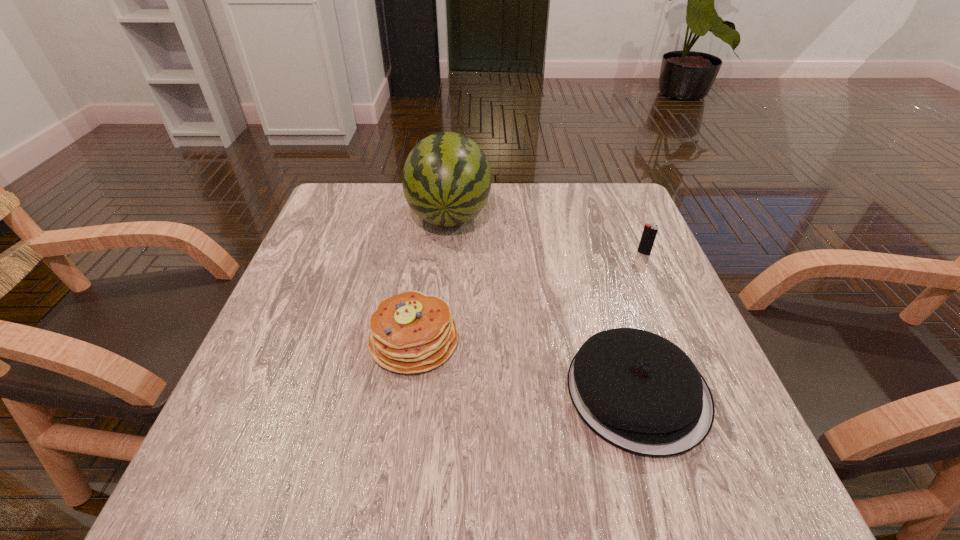
Find the location of a particular element. vacant space that's between the farthest object and the right pancake is located at coordinates (543, 303).

Where is `free space between the shorter pancake and the igniter`? free space between the shorter pancake and the igniter is located at coordinates (640, 322).

Select which object appears as the closest to the shortest object. Please provide its 2D coordinates. Your answer should be formatted as a tuple, i.e. [(x, y)], where the tuple contains the x and y coordinates of a point satisfying the conditions above.

[(410, 332)]

Select which object is the second closest to the third nearest object. Please provide its 2D coordinates. Your answer should be formatted as a tuple, i.e. [(x, y)], where the tuple contains the x and y coordinates of a point satisfying the conditions above.

[(446, 180)]

The image size is (960, 540). What are the coordinates of `free space that satisfies the following two spatial constraints: 1. at the stem end of the shorter pancake; 2. on the right side of the watermelon` in the screenshot? It's located at (433, 392).

The height and width of the screenshot is (540, 960). I want to click on vacant region that satisfies the following two spatial constraints: 1. on the front side of the shorter pancake; 2. on the right side of the left pancake, so click(406, 392).

Where is `vacant point that satisfies the following two spatial constraints: 1. at the stem end of the watermelon; 2. on the right side of the right pancake`? vacant point that satisfies the following two spatial constraints: 1. at the stem end of the watermelon; 2. on the right side of the right pancake is located at coordinates (433, 392).

Where is `vacant region that satisfies the following two spatial constraints: 1. at the stem end of the watermelon; 2. on the left side of the shorter pancake`? The width and height of the screenshot is (960, 540). vacant region that satisfies the following two spatial constraints: 1. at the stem end of the watermelon; 2. on the left side of the shorter pancake is located at coordinates (433, 392).

The height and width of the screenshot is (540, 960). What are the coordinates of `free spot that satisfies the following two spatial constraints: 1. on the back side of the taller pancake; 2. on the right side of the igniter` in the screenshot? It's located at (426, 253).